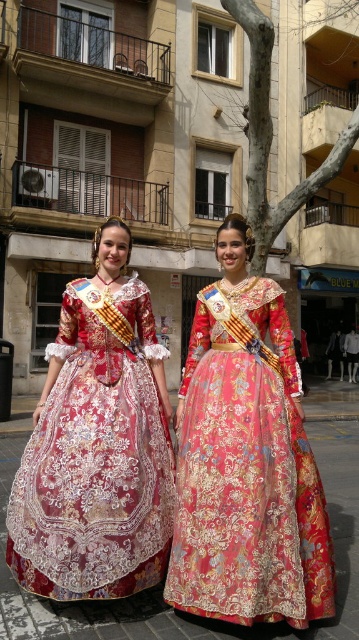
Question: Which object is closer to the camera taking this photo?

Choices:
 (A) shiny silk dress at center
 (B) embroidered silk dress at center

Answer: (B)

Question: Which object appears farthest from the camera in this image?

Choices:
 (A) embroidered silk dress at center
 (B) shiny silk dress at center

Answer: (B)

Question: Can you confirm if embroidered silk dress at center is smaller than shiny silk dress at center?

Choices:
 (A) yes
 (B) no

Answer: (A)

Question: Can you confirm if embroidered silk dress at center is positioned to the left of shiny silk dress at center?

Choices:
 (A) no
 (B) yes

Answer: (A)

Question: Among these objects, which one is farthest from the camera?

Choices:
 (A) embroidered silk dress at center
 (B) shiny silk dress at center

Answer: (B)

Question: In this image, where is embroidered silk dress at center located relative to shiny silk dress at center?

Choices:
 (A) above
 (B) below

Answer: (B)